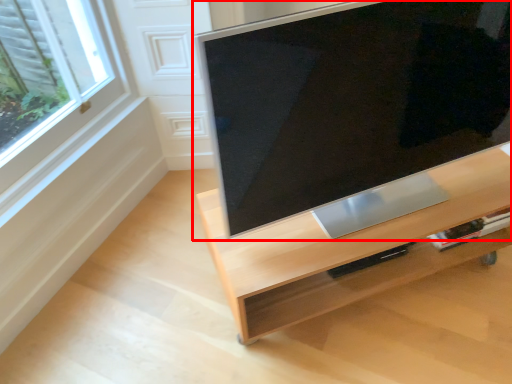
Question: From the image's perspective, what is the correct spatial relationship of television (annotated by the red box) in relation to furniture?

Choices:
 (A) below
 (B) above

Answer: (B)